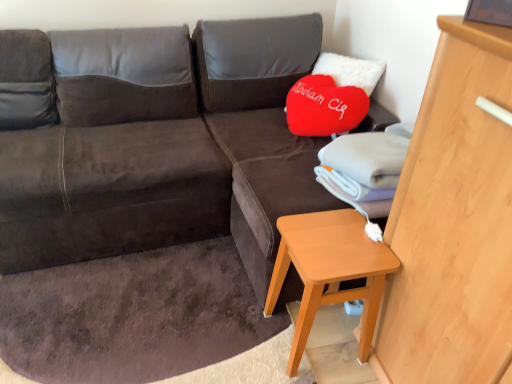
The height and width of the screenshot is (384, 512). I want to click on free space above orange wood side table at lower right (from a real-world perspective), so click(330, 236).